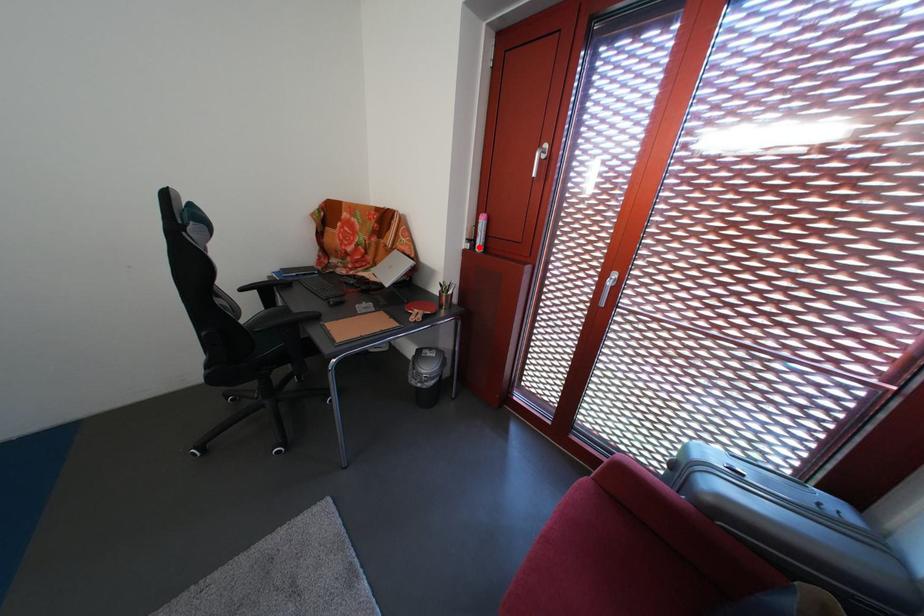
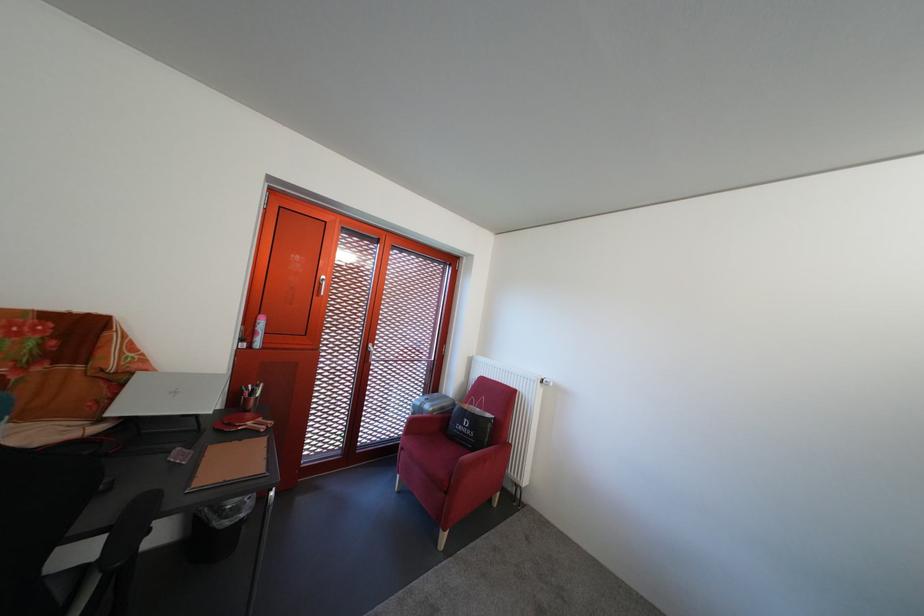
Question: I am providing you with two images of the same scene from different viewpoints. A red point is marked on the first image. Can you still see the location of the red point in image 2?

Choices:
 (A) Yes
 (B) No

Answer: (A)